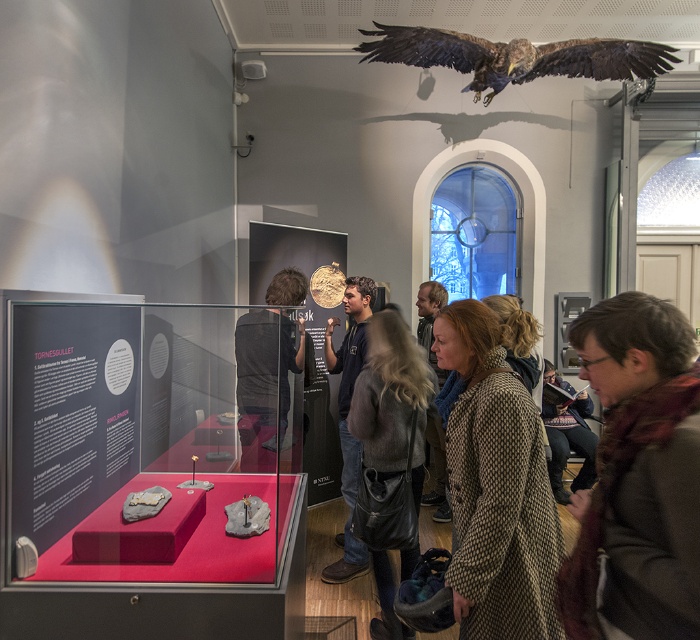
Question: Considering the relative positions of brown wool scarf at lower right and dark blue jeans at center in the image provided, where is brown wool scarf at lower right located with respect to dark blue jeans at center?

Choices:
 (A) left
 (B) right

Answer: (B)

Question: Among these objects, which one is farthest from the camera?

Choices:
 (A) leather jacket at center
 (B) dark gray fabric jacket at center
 (C) brown wool coat at center

Answer: (C)

Question: Can you confirm if brown wool scarf at lower right is thinner than dark blue jeans at center?

Choices:
 (A) no
 (B) yes

Answer: (B)

Question: Among these points, which one is farthest from the camera?

Choices:
 (A) (382, 376)
 (B) (617, 452)
 (C) (343, 461)

Answer: (C)

Question: Based on their relative distances, which object is nearer to the brown leather jacket at lower right?

Choices:
 (A) brown feathered falcon at upper right
 (B) brown wool scarf at lower right
 (C) leather jacket at center

Answer: (C)

Question: Can you confirm if brown wool scarf at lower right is positioned to the left of brown wool coat at lower right?

Choices:
 (A) no
 (B) yes

Answer: (A)